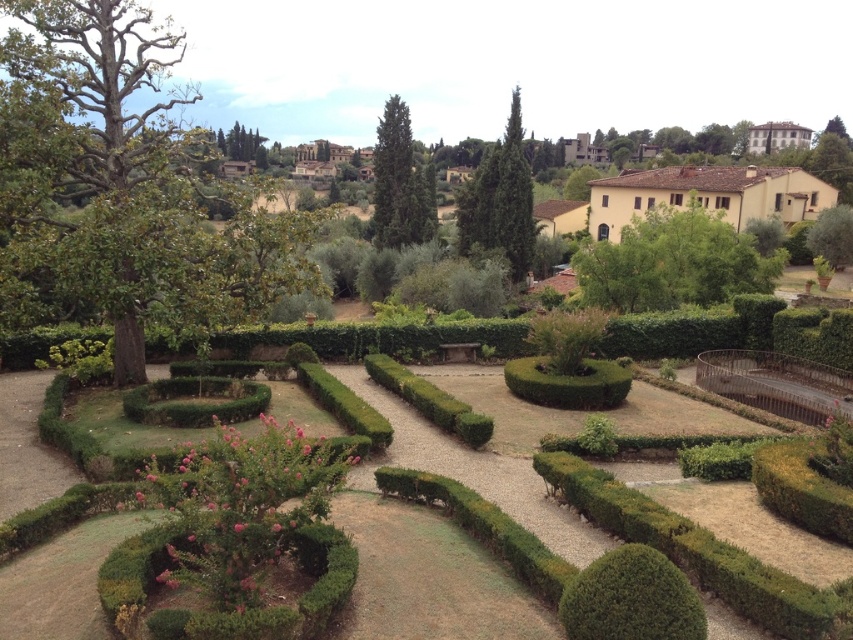
Question: Which object appears farthest from the camera in this image?

Choices:
 (A) green textured tree at center
 (B) green leafy tree at left
 (C) green leafy bush at lower right
 (D) green leafy tree at upper center

Answer: (D)

Question: Is the position of green leafy bush at lower right less distant than that of green leafy bush at right?

Choices:
 (A) no
 (B) yes

Answer: (B)

Question: In this image, where is green textured tree at center located relative to green leafy bush at right?

Choices:
 (A) right
 (B) left

Answer: (B)

Question: Considering the real-world distances, which object is closest to the green leafy bush at lower right?

Choices:
 (A) green leafy bush at right
 (B) green leafy tree at left
 (C) green leafy tree at upper center

Answer: (B)

Question: Does green leafy tree at left appear on the right side of green textured tree at center?

Choices:
 (A) no
 (B) yes

Answer: (A)

Question: Which of these objects is positioned farthest from the green textured tree at center?

Choices:
 (A) green leafy bush at lower right
 (B) green leafy tree at left
 (C) green leafy bush at right

Answer: (A)